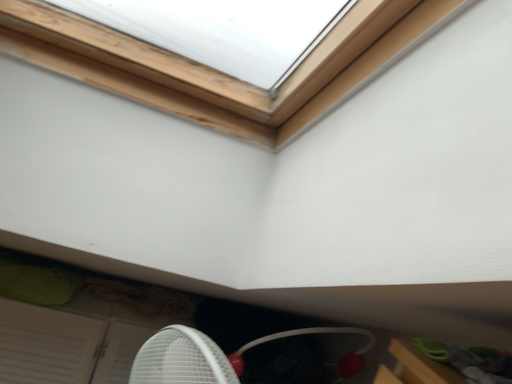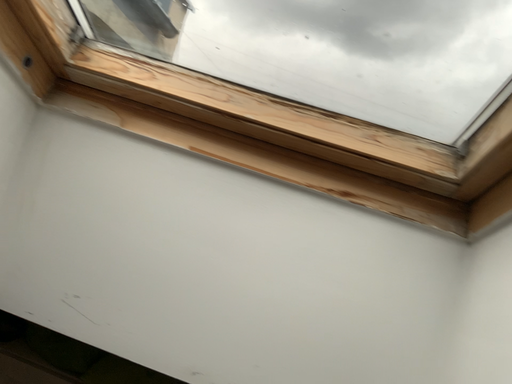
Question: How did the camera likely rotate when shooting the video?

Choices:
 (A) rotated upward
 (B) rotated downward

Answer: (A)